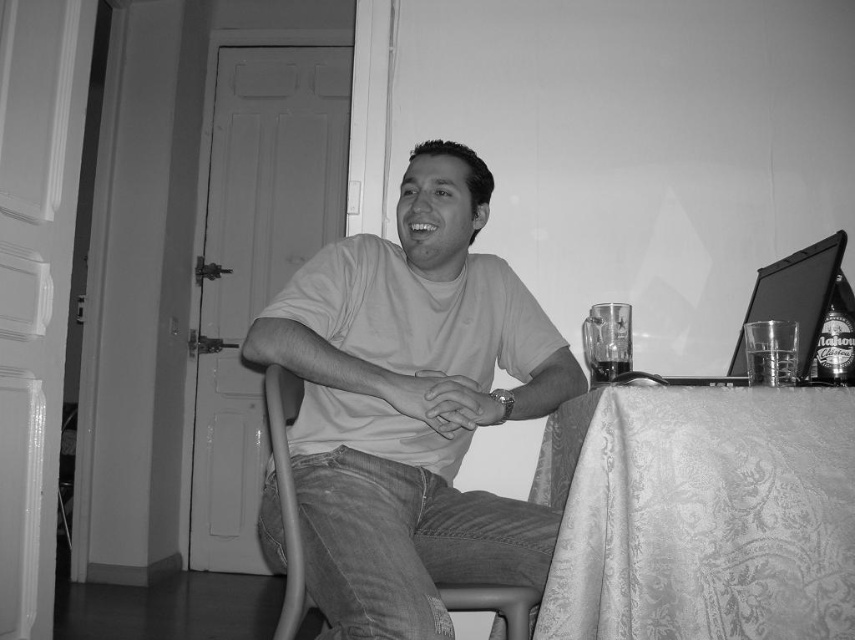
Is silky white tablecloth at lower right shorter than translucent glass at table right?

In fact, silky white tablecloth at lower right may be taller than translucent glass at table right.

Does point (793, 628) lie in front of point (600, 360)?

Yes, it is in front of point (600, 360).

Locate an element on the screen. This screenshot has height=640, width=855. silky white tablecloth at lower right is located at coordinates (703, 516).

Where is `silky white tablecloth at lower right`? Image resolution: width=855 pixels, height=640 pixels. silky white tablecloth at lower right is located at coordinates (703, 516).

Is smooth cotton t-shirt at center thinner than translucent glass at table right?

Incorrect, smooth cotton t-shirt at center's width is not less than translucent glass at table right's.

Which of these two, smooth cotton t-shirt at center or translucent glass at table right, stands shorter?

translucent glass at table right is shorter.

This screenshot has width=855, height=640. What are the coordinates of `smooth cotton t-shirt at center` in the screenshot? It's located at (411, 404).

Can you confirm if metallic gray chair at center is thinner than translucent glass bottle at right?

Indeed, metallic gray chair at center has a lesser width compared to translucent glass bottle at right.

Is point (286, 588) positioned in front of point (836, 365)?

Yes, it is in front of point (836, 365).

Is point (270, 380) closer to camera compared to point (841, 273)?

Yes, it is.

Identify the location of metallic gray chair at center. (286, 492).